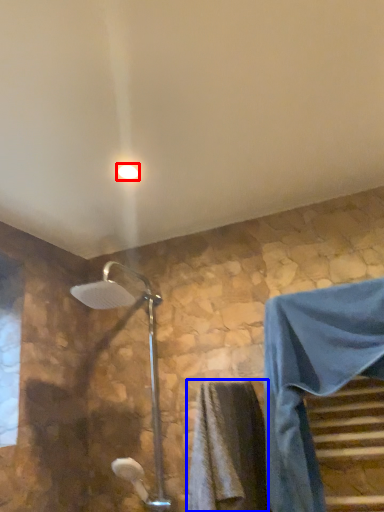
Question: Which of the following is the closest to the observer, light fixture (highlighted by a red box) or bath towel (highlighted by a blue box)?

Choices:
 (A) light fixture
 (B) bath towel

Answer: (B)